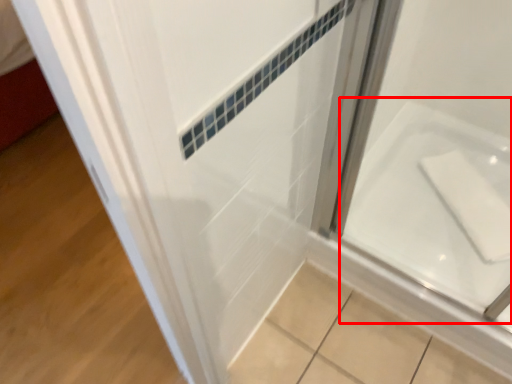
Question: From the image's perspective, considering the relative positions of bath (annotated by the red box) and door in the image provided, where is bath (annotated by the red box) located with respect to the staircase?

Choices:
 (A) below
 (B) above

Answer: (B)